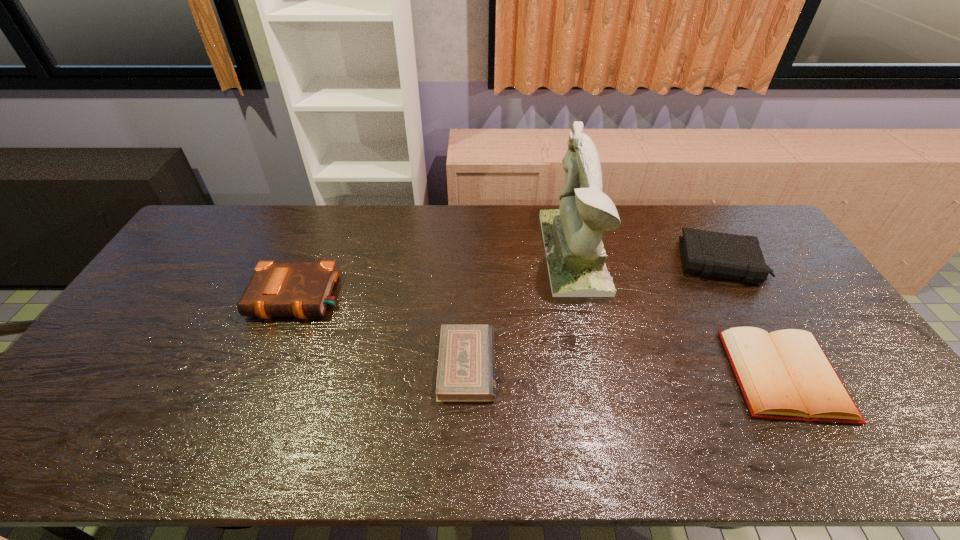
The width and height of the screenshot is (960, 540). I want to click on sculpture, so click(572, 235).

Identify the location of the tallest object. This screenshot has height=540, width=960. (572, 235).

Where is `the leftmost Bible`? The width and height of the screenshot is (960, 540). the leftmost Bible is located at coordinates (277, 289).

Where is `the third tallest Bible`? This screenshot has width=960, height=540. the third tallest Bible is located at coordinates (785, 374).

The height and width of the screenshot is (540, 960). I want to click on the second object from left to right, so click(x=466, y=364).

This screenshot has height=540, width=960. In order to click on the shortest object in this screenshot , I will do `click(466, 364)`.

Identify the location of vacant space located 0.150m on the base of the sculpture. (501, 252).

Find the location of `vacant space located on the base of the sculpture`. vacant space located on the base of the sculpture is located at coordinates (440, 252).

Locate an element on the screen. The height and width of the screenshot is (540, 960). vacant region located on the base of the sculpture is located at coordinates (481, 252).

Locate an element on the screen. free space located 0.330m on the spine side of the leftmost object is located at coordinates (244, 430).